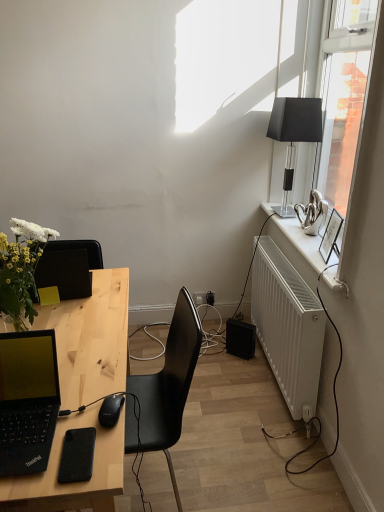
At what (x,y) coordinates should I click in order to perform the action: click on unoccupied region to the right of black matte laptop at left. Please return your answer as a coordinate pair (x, y). Looking at the image, I should click on (89, 417).